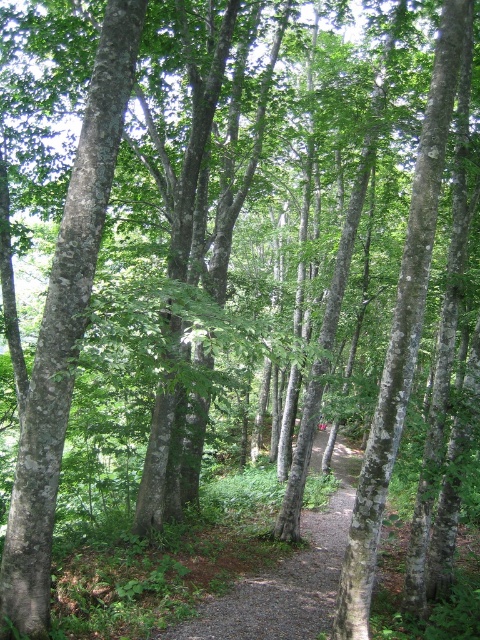
Is point (118, 1) closer to camera compared to point (315, 465)?

Yes, point (118, 1) is closer to viewer.

Between smooth bark tree at center and dirt/gravel path at center, which one has less height?

dirt/gravel path at center is shorter.

Where is `smooth bark tree at center`? The image size is (480, 640). smooth bark tree at center is located at coordinates (64, 326).

Locate an element on the screen. This screenshot has height=640, width=480. smooth bark tree at center is located at coordinates (64, 326).